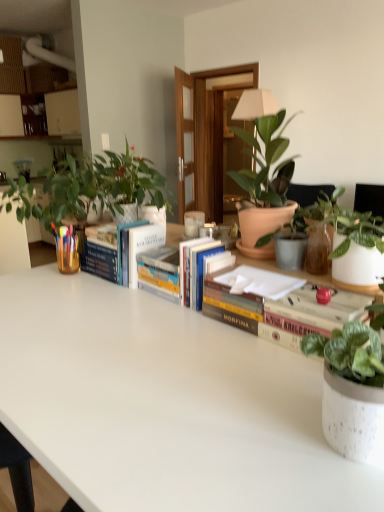
The height and width of the screenshot is (512, 384). What do you see at coordinates (351, 242) in the screenshot?
I see `speckled white pot at upper right, the 6th houseplant from the left` at bounding box center [351, 242].

How much space does hardcover book at center, arranged as the first paperback book when viewed from the back, occupy vertically?

It is 14.09 centimeters.

The width and height of the screenshot is (384, 512). Describe the element at coordinates (101, 252) in the screenshot. I see `hardcover book at center, placed as the second paperback book when sorted from front to back` at that location.

What do you see at coordinates (265, 186) in the screenshot?
I see `terracotta pot plant at center, which is counted as the 4th houseplant, starting from the right` at bounding box center [265, 186].

Find the location of a particular element. green matte plant at left, which appears as the 6th houseplant when viewed from the right is located at coordinates (89, 188).

The height and width of the screenshot is (512, 384). Describe the element at coordinates (258, 282) in the screenshot. I see `white matte paper at center, positioned as the first paperback book in front-to-back order` at that location.

Describe the element at coordinates (315, 221) in the screenshot. I see `terracotta pot at center, positioned as the third houseplant in right-to-left order` at that location.

At what (x,y) coordinates should I click in order to perform the action: click on speckled white pot at upper right, the 6th houseplant from the left. Please return your answer as a coordinate pair (x, y). The width and height of the screenshot is (384, 512). Looking at the image, I should click on (351, 242).

Choose the correct answer: Is speckled ceramic pot at lower right, the 2th houseplant positioned from the right, inside hardcover books at center, marked as the 2th book in a left-to-right arrangement, or outside it?

speckled ceramic pot at lower right, the 2th houseplant positioned from the right, is spatially situated outside hardcover books at center, marked as the 2th book in a left-to-right arrangement.

Is speckled ceramic pot at lower right, the 2th houseplant positioned from the right, wider than hardcover books at center, acting as the 2th book starting from the right?

Indeed, speckled ceramic pot at lower right, the 2th houseplant positioned from the right, has a greater width compared to hardcover books at center, acting as the 2th book starting from the right.

In the scene shown: Considering the relative sizes of speckled ceramic pot at lower right, which ranks as the 5th houseplant in left-to-right order, and hardcover books at center, marked as the 2th book in a left-to-right arrangement, in the image provided, is speckled ceramic pot at lower right, which ranks as the 5th houseplant in left-to-right order, taller than hardcover books at center, marked as the 2th book in a left-to-right arrangement,?

Yes.

From the image's perspective, which object appears higher, speckled ceramic pot at lower right, the 2th houseplant positioned from the right, or hardcover books at center, acting as the 2th book starting from the right?

hardcover books at center, acting as the 2th book starting from the right, appears higher in the image.

From the image's perspective, is speckled ceramic pot at lower right, which ranks as the 5th houseplant in left-to-right order, positioned above or below terracotta pot at center, placed as the fourth houseplant when sorted from left to right?

speckled ceramic pot at lower right, which ranks as the 5th houseplant in left-to-right order, is below terracotta pot at center, placed as the fourth houseplant when sorted from left to right.

Is speckled ceramic pot at lower right, which ranks as the 5th houseplant in left-to-right order, at the right side of terracotta pot at center, positioned as the third houseplant in right-to-left order?

Yes.

Can you tell me how much speckled ceramic pot at lower right, which ranks as the 5th houseplant in left-to-right order, and terracotta pot at center, placed as the fourth houseplant when sorted from left to right, differ in facing direction?

There is a 89.7-degree angle between the facing directions of speckled ceramic pot at lower right, which ranks as the 5th houseplant in left-to-right order, and terracotta pot at center, placed as the fourth houseplant when sorted from left to right.

I want to click on the 1st houseplant above the speckled ceramic pot at lower right, which ranks as the 5th houseplant in left-to-right order (from the image's perspective), so click(315, 221).

From a real-world perspective, is speckled white pot at upper right, the first houseplant positioned from the right, under terracotta pot plant at center, the 3th houseplant when ordered from left to right?

Correct, in the physical world, speckled white pot at upper right, the first houseplant positioned from the right, is lower than terracotta pot plant at center, the 3th houseplant when ordered from left to right.

Is speckled white pot at upper right, the first houseplant positioned from the right, not close to terracotta pot plant at center, the 3th houseplant when ordered from left to right?

No, there isn't a large distance between speckled white pot at upper right, the first houseplant positioned from the right, and terracotta pot plant at center, the 3th houseplant when ordered from left to right.

From the image's perspective, is speckled white pot at upper right, the 6th houseplant from the left, on terracotta pot plant at center, which is counted as the 4th houseplant, starting from the right?

Actually, speckled white pot at upper right, the 6th houseplant from the left, appears below terracotta pot plant at center, which is counted as the 4th houseplant, starting from the right, in the image.

Find the location of a particular element. Image resolution: width=384 pixels, height=512 pixels. the 2nd houseplant in front when counting from the terracotta pot plant at center, which is counted as the 4th houseplant, starting from the right is located at coordinates (351, 242).

From the image's perspective, which houseplant is the 1st one above the hardcover book at center, which is the 2th paperback book in right-to-left order? Please provide its 2D coordinates.

[(315, 221)]

Is hardcover book at center, arranged as the first paperback book when viewed from the back, placed right next to terracotta pot at center, placed as the fourth houseplant when sorted from left to right?

They are not placed beside each other.

In the scene shown: Considering the relative positions of hardcover book at center, which is the 2th paperback book in right-to-left order, and terracotta pot at center, placed as the fourth houseplant when sorted from left to right, in the image provided, is hardcover book at center, which is the 2th paperback book in right-to-left order, to the right of terracotta pot at center, placed as the fourth houseplant when sorted from left to right, from the viewer's perspective?

No.

Does speckled white pot at upper right, the 6th houseplant from the left, have a greater height compared to hardcover book at center, which is the 3th book from right to left?

Incorrect, the height of speckled white pot at upper right, the 6th houseplant from the left, is not larger of that of hardcover book at center, which is the 3th book from right to left.

Is speckled white pot at upper right, the first houseplant positioned from the right, looking in the opposite direction of hardcover book at center, which is the 3th book from right to left?

No, speckled white pot at upper right, the first houseplant positioned from the right,'s orientation is not away from hardcover book at center, which is the 3th book from right to left.

Considering the points (354, 259) and (141, 246), which point is behind, point (354, 259) or point (141, 246)?

The point (141, 246) is farther from the camera.

From a real-world perspective, which object rests below the other?

hardcover book at center, which is the 1th book in left-to-right order, from a real-world perspective.

How much distance is there between terracotta pot at center, positioned as the third houseplant in right-to-left order, and hardcover book at center, placed as the second paperback book when sorted from front to back?

They are 25.72 inches apart.

Between terracotta pot at center, positioned as the third houseplant in right-to-left order, and hardcover book at center, marked as the first paperback book in a left-to-right arrangement, which one has more height?

terracotta pot at center, positioned as the third houseplant in right-to-left order.

In the scene shown: Is terracotta pot at center, positioned as the third houseplant in right-to-left order, next to hardcover book at center, arranged as the first paperback book when viewed from the back, and touching it?

No.

Which object is wider, terracotta pot at center, placed as the fourth houseplant when sorted from left to right, or hardcover book at center, marked as the first paperback book in a left-to-right arrangement?

terracotta pot at center, placed as the fourth houseplant when sorted from left to right.

Is speckled white pot at upper right, the 6th houseplant from the left, positioned far away from green matte plant at upper left, positioned as the fifth houseplant in right-to-left order?

They are positioned close to each other.

From a real-world perspective, is speckled white pot at upper right, the first houseplant positioned from the right, above or below green matte plant at upper left, which is the 2th houseplant in left-to-right order?

From a real-world perspective, speckled white pot at upper right, the first houseplant positioned from the right, is physically below green matte plant at upper left, which is the 2th houseplant in left-to-right order.

Which is closer, (374,236) or (121,214)?

Positioned in front is point (374,236).

This screenshot has height=512, width=384. I want to click on houseplant that is the 3rd one when counting downward from the green matte plant at upper left, which is the 2th houseplant in left-to-right order (from the image's perspective), so click(351, 242).

Where is `the 2nd book behind the speckled ceramic pot at lower right, which ranks as the 5th houseplant in left-to-right order`? This screenshot has height=512, width=384. the 2nd book behind the speckled ceramic pot at lower right, which ranks as the 5th houseplant in left-to-right order is located at coordinates (173, 288).

This screenshot has width=384, height=512. I want to click on houseplant directly beneath the terracotta pot at center, positioned as the third houseplant in right-to-left order (from a real-world perspective), so click(352, 391).

From the image, which object appears to be nearer to speckled white pot at upper right, the first houseplant positioned from the right, white matte paper at center, the second paperback book when ordered from back to front, or hardcover book at center, positioned as the 3th book in left-to-right order?

white matte paper at center, the second paperback book when ordered from back to front, is closer to speckled white pot at upper right, the first houseplant positioned from the right.

Based on their spatial positions, is white matte table at center or hardcover book at center, positioned as the 3th book in left-to-right order, closer to hardcover books at center, marked as the 2th book in a left-to-right arrangement?

hardcover book at center, positioned as the 3th book in left-to-right order, lies closer to hardcover books at center, marked as the 2th book in a left-to-right arrangement, than the other object.

When comparing their distances from hardcover book at center, positioned as the 3th book in left-to-right order, does white matte table at center or hardcover books at center, marked as the 2th book in a left-to-right arrangement, seem further?

Among the two, hardcover books at center, marked as the 2th book in a left-to-right arrangement, is located further to hardcover book at center, positioned as the 3th book in left-to-right order.

Based on their spatial positions, is green matte plant at left, which appears as the 6th houseplant when viewed from the right, or hardcover book at center, positioned as the 3th book in left-to-right order, further from terracotta pot at center, placed as the fourth houseplant when sorted from left to right?

green matte plant at left, which appears as the 6th houseplant when viewed from the right, is positioned further to the anchor terracotta pot at center, placed as the fourth houseplant when sorted from left to right.

Looking at the image, which one is located closer to terracotta pot at center, placed as the fourth houseplant when sorted from left to right, terracotta pot plant at center, which is counted as the 4th houseplant, starting from the right, or hardcover book at center, positioned as the 3th book in left-to-right order?

Based on the image, terracotta pot plant at center, which is counted as the 4th houseplant, starting from the right, appears to be nearer to terracotta pot at center, placed as the fourth houseplant when sorted from left to right.

In the scene shown: Which object lies nearer to the anchor point green matte plant at upper left, which is the 2th houseplant in left-to-right order, green matte plant at left, which appears as the 6th houseplant when viewed from the right, or white matte paper at center, the second paperback book when ordered from back to front?

green matte plant at left, which appears as the 6th houseplant when viewed from the right, is positioned closer to the anchor green matte plant at upper left, which is the 2th houseplant in left-to-right order.

When comparing their distances from terracotta pot plant at center, which is counted as the 4th houseplant, starting from the right, does white matte table at center or speckled ceramic pot at lower right, the 2th houseplant positioned from the right, seem further?

The object further to terracotta pot plant at center, which is counted as the 4th houseplant, starting from the right, is speckled ceramic pot at lower right, the 2th houseplant positioned from the right.

Based on their spatial positions, is speckled ceramic pot at lower right, which ranks as the 5th houseplant in left-to-right order, or speckled white pot at upper right, the first houseplant positioned from the right, closer to hardcover book at center, arranged as the first paperback book when viewed from the back?

speckled white pot at upper right, the first houseplant positioned from the right, lies closer to hardcover book at center, arranged as the first paperback book when viewed from the back, than the other object.

I want to click on book between white matte table at center and white matte paper at center, the second paperback book when ordered from back to front, along the z-axis, so click(264, 313).

Locate an element on the screen. This screenshot has width=384, height=512. houseplant located between hardcover book at center, which is the 3th book from right to left, and terracotta pot at center, placed as the fourth houseplant when sorted from left to right, in the left-right direction is located at coordinates (265, 186).

This screenshot has height=512, width=384. I want to click on book between green matte plant at upper left, positioned as the fifth houseplant in right-to-left order, and hardcover books at center, marked as the 2th book in a left-to-right arrangement, in the vertical direction, so click(x=119, y=249).

Image resolution: width=384 pixels, height=512 pixels. I want to click on paperback book between white matte table at center and hardcover book at center, which is the 2th paperback book in right-to-left order, in the front-back direction, so click(x=258, y=282).